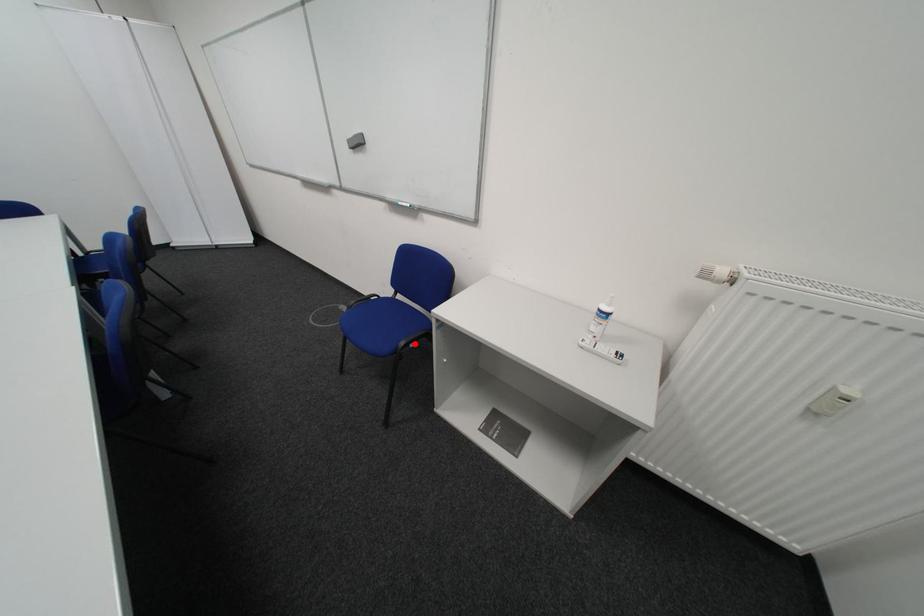
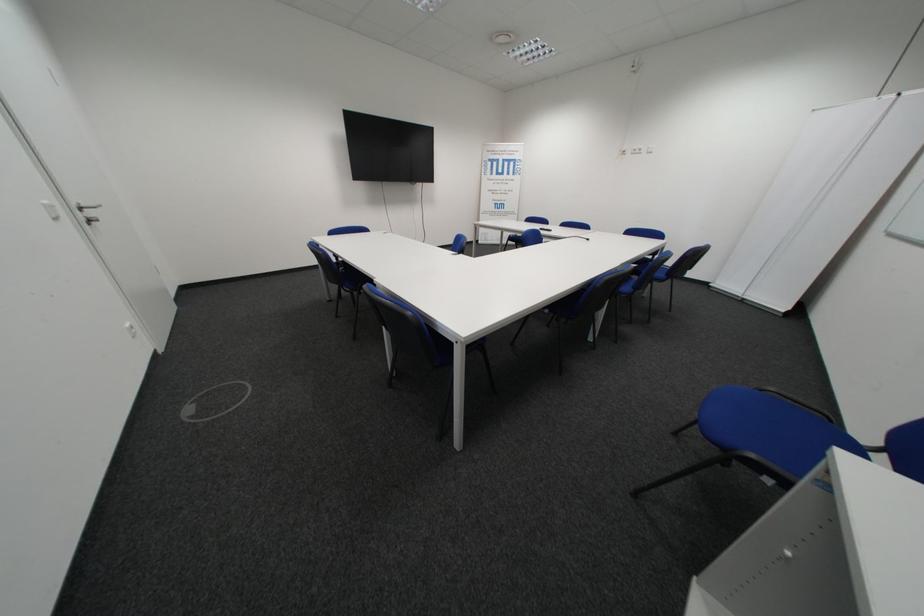
Where in the second image is the point corresponding to the highlighted location from the first image?

(761, 456)